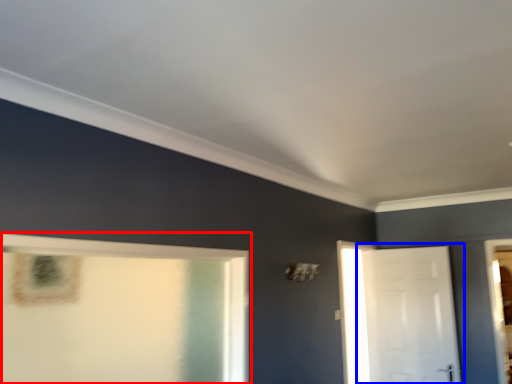
Question: Which object appears closest to the camera in this image, window (highlighted by a red box) or door (highlighted by a blue box)?

Choices:
 (A) window
 (B) door

Answer: (A)